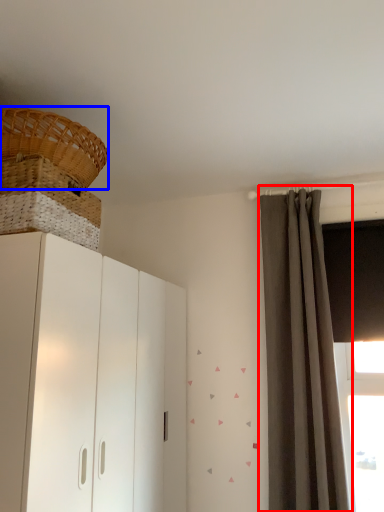
Question: Which object appears closest to the camera in this image, curtain (highlighted by a red box) or basket (highlighted by a blue box)?

Choices:
 (A) curtain
 (B) basket

Answer: (B)